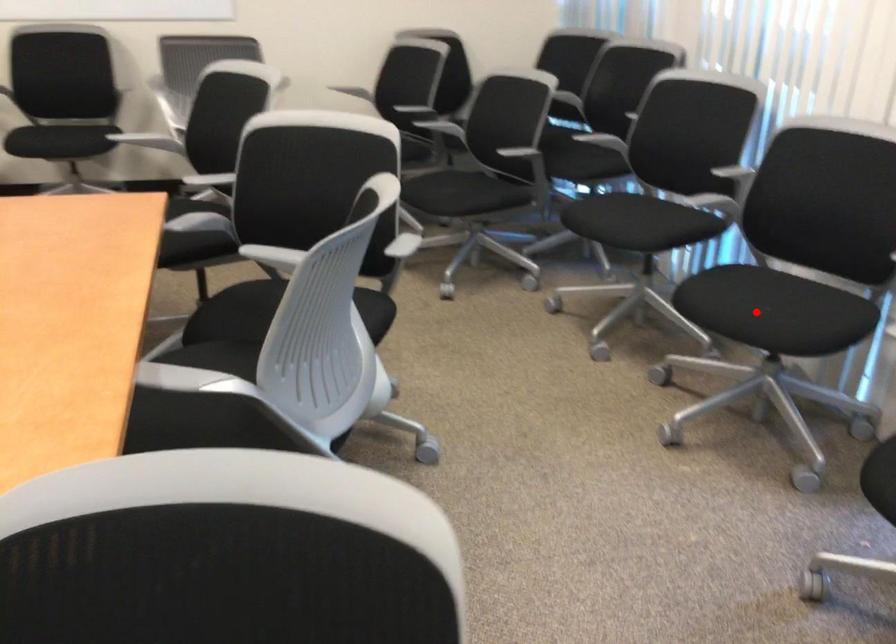
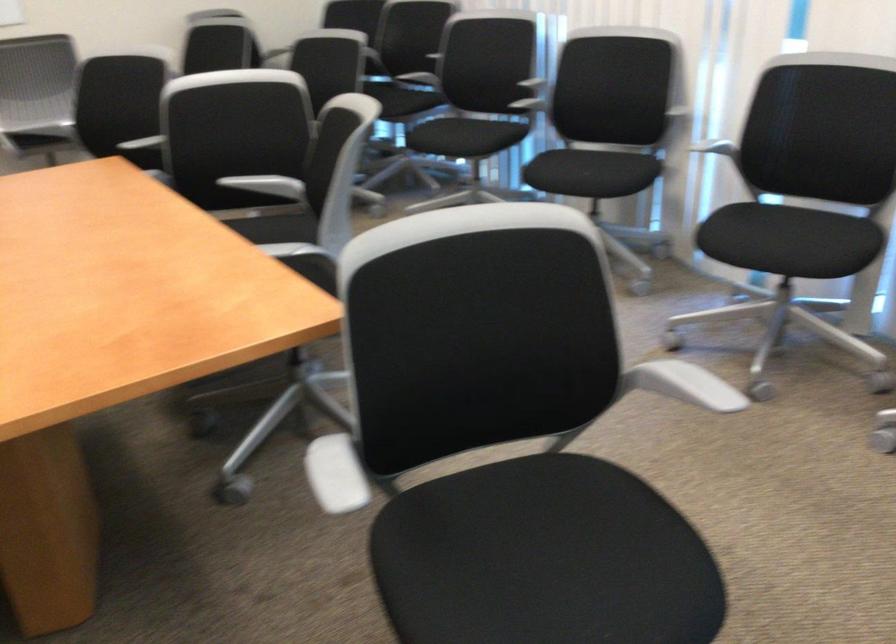
Where in the second image is the point corresponding to the highlighted location from the first image?

(587, 174)